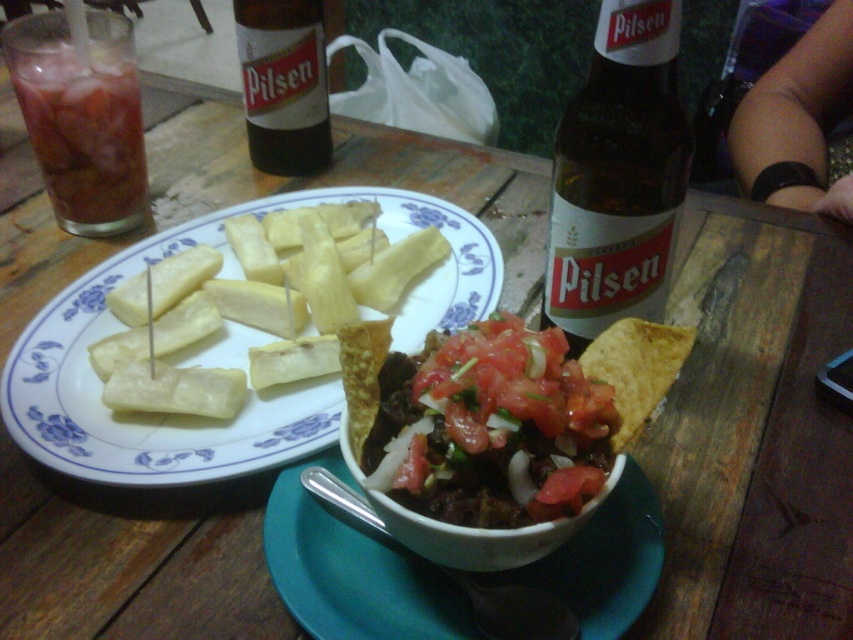
Is translucent glass bottle at upper center bigger than yellow wax cheese at center?

Yes, translucent glass bottle at upper center is bigger than yellow wax cheese at center.

Can you confirm if translucent glass bottle at upper center is positioned below yellow wax cheese at center?

Incorrect, translucent glass bottle at upper center is not positioned below yellow wax cheese at center.

Does point (573, 234) lie in front of point (154, 284)?

That is True.

Locate an element on the screen. Image resolution: width=853 pixels, height=640 pixels. translucent glass bottle at upper center is located at coordinates (618, 176).

Measure the distance from translucent glass bottle at upper center to brown glass bottle at upper center.

translucent glass bottle at upper center is 36.84 centimeters away from brown glass bottle at upper center.

Between point (590, 268) and point (300, 112), which one is positioned in front?

Point (590, 268) is more forward.

What do you see at coordinates (618, 176) in the screenshot? I see `translucent glass bottle at upper center` at bounding box center [618, 176].

This screenshot has width=853, height=640. I want to click on translucent glass bottle at upper center, so click(618, 176).

Does yellow rubbery plantains at center have a smaller size compared to yellow wax cheese at center?

No, yellow rubbery plantains at center is not smaller than yellow wax cheese at center.

Between yellow rubbery plantains at center and yellow wax cheese at center, which one is positioned higher?

yellow wax cheese at center is higher up.

Is point (399, 344) farther from viewer compared to point (187, 288)?

No, it is not.

Find the location of a particular element. Image resolution: width=853 pixels, height=640 pixels. yellow rubbery plantains at center is located at coordinates (252, 392).